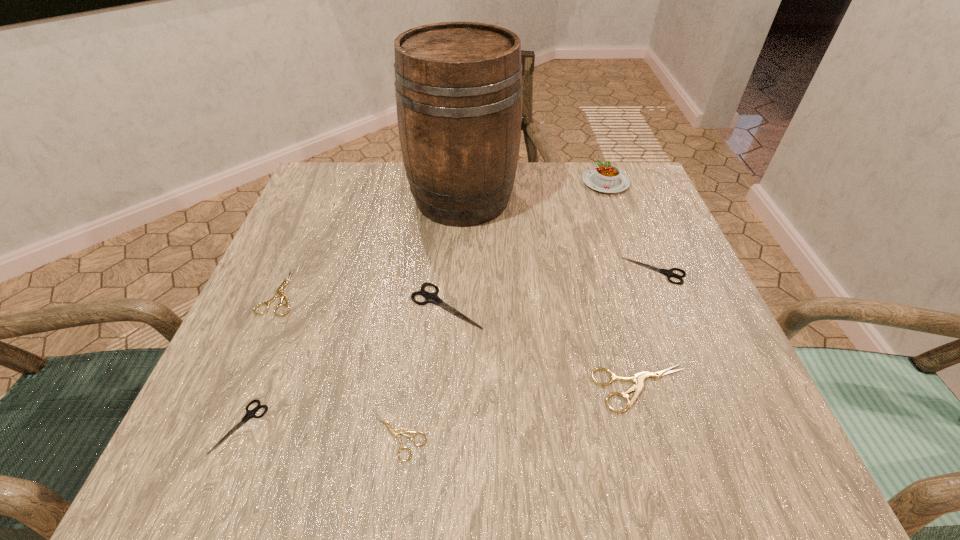
The image size is (960, 540). I want to click on vacant space that is in between the tallest object and the biggest black shears, so pos(455,252).

Image resolution: width=960 pixels, height=540 pixels. I want to click on vacant region between the third tallest object and the second smallest beige shears, so click(x=363, y=299).

Identify the location of free space between the nearest black shears and the tallest object. The width and height of the screenshot is (960, 540). (351, 312).

You are a GUI agent. You are given a task and a screenshot of the screen. Output one action in this format:
    pyautogui.click(x=<x>, y=<y>)
    Task: Click on the fourth closest object to the leftmost beige shears
    
    Given the screenshot: What is the action you would take?
    pyautogui.click(x=395, y=433)

Find the location of `object that is the fourth closest to the rightmost beige shears`. object that is the fourth closest to the rightmost beige shears is located at coordinates (458, 85).

Locate an element on the screen. Image resolution: width=960 pixels, height=540 pixels. shears that stands as the third closest to the rightmost black shears is located at coordinates (395, 433).

The height and width of the screenshot is (540, 960). Find the location of `shears that is the closest to the rightmost beige shears`. shears that is the closest to the rightmost beige shears is located at coordinates (669, 273).

Select which black shears is the closest to the farthest beige shears. Please provide its 2D coordinates. Your answer should be formatted as a tuple, i.e. [(x, y)], where the tuple contains the x and y coordinates of a point satisfying the conditions above.

[(249, 414)]

At what (x,y) coordinates should I click in order to perform the action: click on black shears that stands as the second closest to the leftmost black shears. Please return your answer as a coordinate pair (x, y). The width and height of the screenshot is (960, 540). Looking at the image, I should click on coord(669,273).

Image resolution: width=960 pixels, height=540 pixels. What are the coordinates of `the closest beige shears to the second biggest black shears` in the screenshot? It's located at (638, 378).